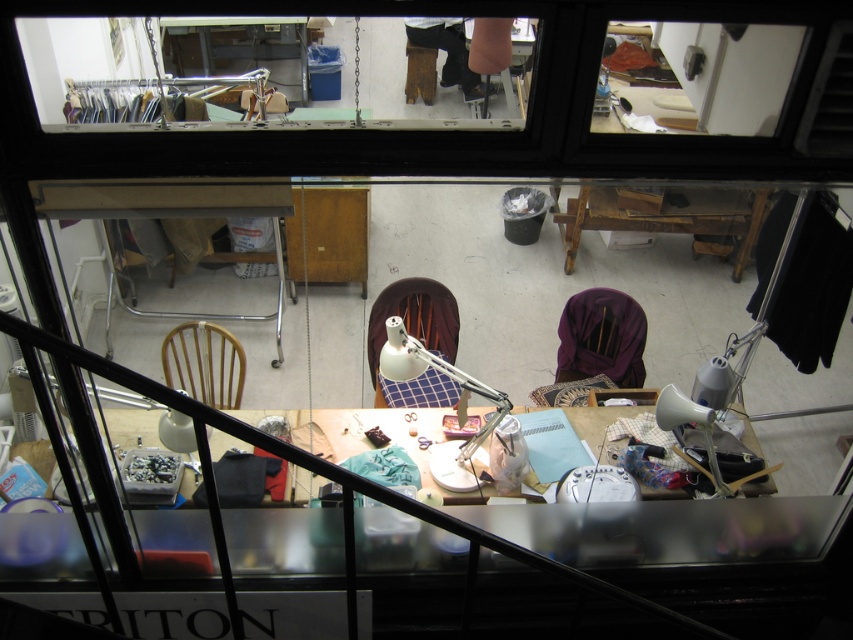
Question: Which point is farther to the camera?

Choices:
 (A) (445, 40)
 (B) (601, 300)
 (C) (223, 364)
 (D) (416, 324)

Answer: (A)

Question: Is the position of wooden sewing machine at center less distant than that of white matte lamp at center?

Choices:
 (A) no
 (B) yes

Answer: (A)

Question: In this image, where is purple fabric chair at center located relative to dark brown leather pants at upper center?

Choices:
 (A) right
 (B) left

Answer: (A)

Question: Among these points, which one is farthest from the camera?

Choices:
 (A) (613, 312)
 (B) (390, 332)

Answer: (A)

Question: Can you confirm if wooden chair at center-left is positioned to the left of white matte lamp at center?

Choices:
 (A) no
 (B) yes

Answer: (B)

Question: Which point is farther from the camera taking this photo?

Choices:
 (A) (467, 61)
 (B) (190, 483)
 (C) (622, 340)

Answer: (A)